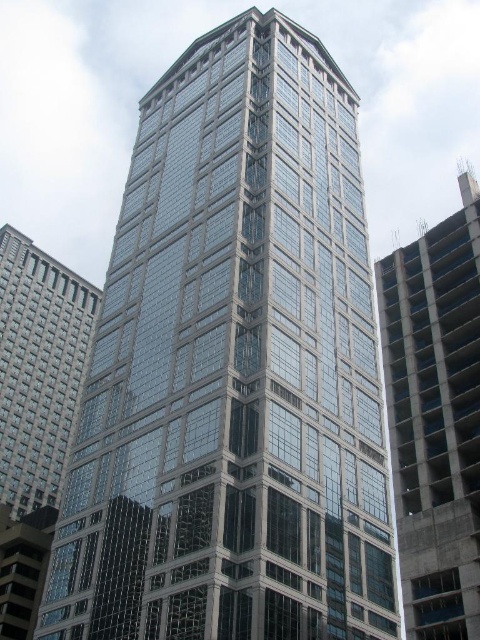
Is concrete at right above matte glass building at left?

Yes, concrete at right is above matte glass building at left.

Is concrete at right below matte glass building at left?

Actually, concrete at right is above matte glass building at left.

Measure the distance between concrete at right and camera.

concrete at right and camera are 122.62 feet apart.

At what (x,y) coordinates should I click in order to perform the action: click on concrete at right. Please return your answer as a coordinate pair (x, y). The height and width of the screenshot is (640, 480). Looking at the image, I should click on (435, 417).